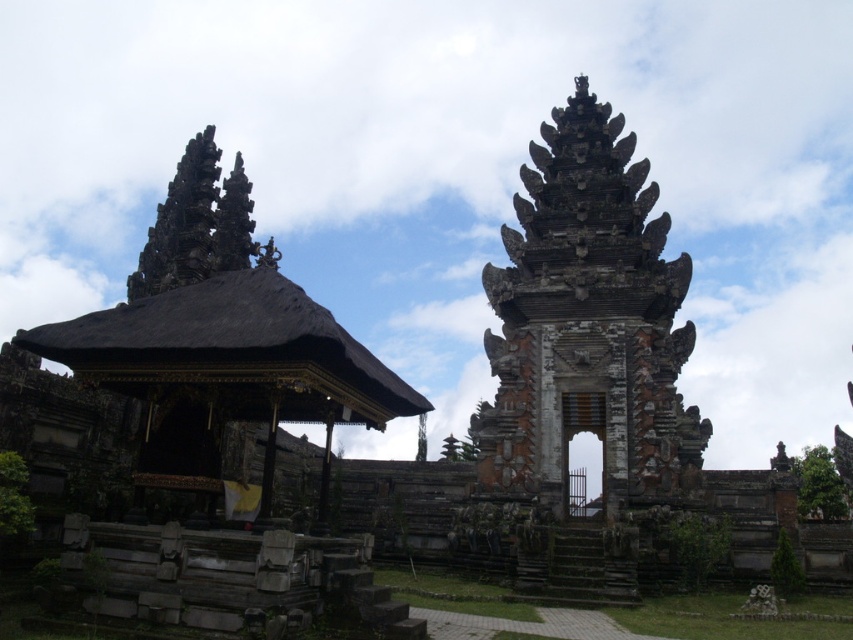
You are standing in the Balinese temple complex and want to take a photo of both the pavilion with a dark, sloped roof on the left and the tall, multi tiered temple tower on the right. If you position yourself so that the point at (585, 385) is closer to you than the point at (227, 214), will the pavilion with a dark, sloped roof on the left be in front of the tall, multi tiered temple tower on the right in your photo?

Point (585, 385) is in front of point (227, 214), so yes, the pavilion with a dark, sloped roof on the left will be in front of the tall, multi tiered temple tower on the right in your photo.

You are a tourist visiting the temple complex and want to take a photo that includes both the dark brown stone temple at right and the black stone gazebo at center. Which structure should you position closer to the camera to ensure both are fully visible in the frame?

You should position the dark brown stone temple at right closer to the camera because it is taller than the black stone gazebo at center, allowing both to fit within the frame without one being cut off.

You are a tourist standing in front of the dark brown stone temple at right and the black stone gazebo at center. Which structure is closer to you?

The dark brown stone temple at right is closer to you because the black stone gazebo at center is behind it.